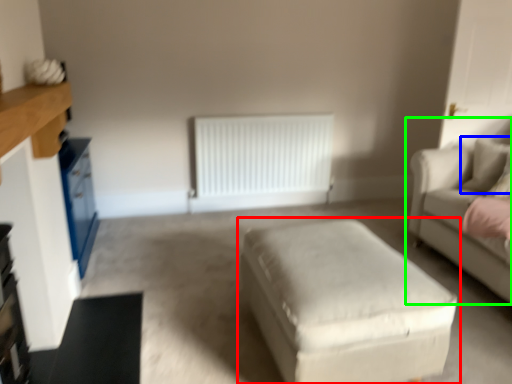
Question: Estimate the real-world distances between objects in this image. Which object is closer to table (highlighted by a red box), pillow (highlighted by a blue box) or studio couch (highlighted by a green box)?

Choices:
 (A) pillow
 (B) studio couch

Answer: (B)